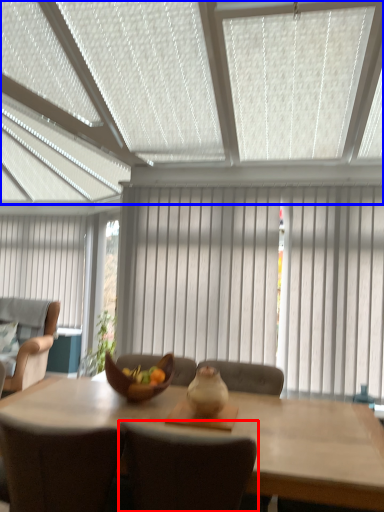
Question: Which object is closer to the camera taking this photo, chair (highlighted by a red box) or window blind (highlighted by a blue box)?

Choices:
 (A) chair
 (B) window blind

Answer: (B)